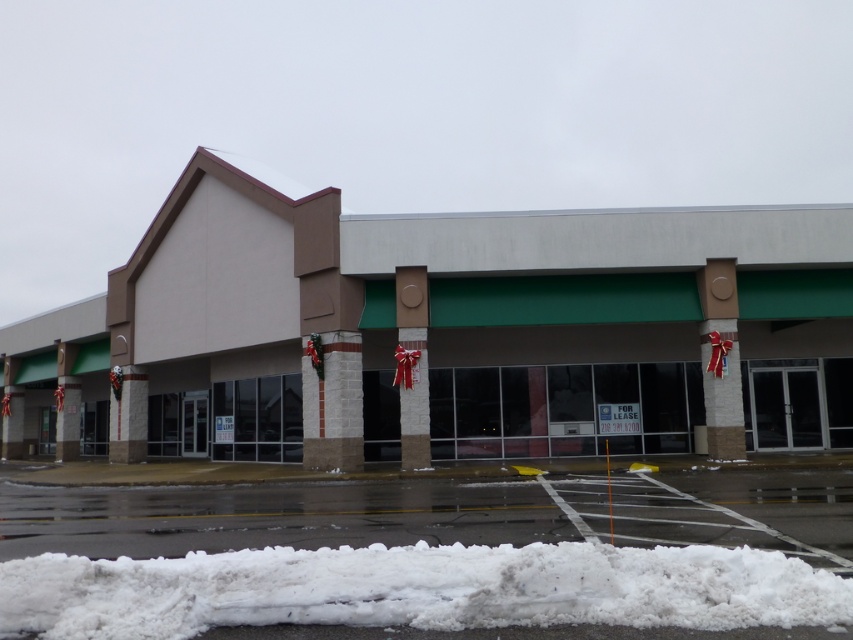
Question: Estimate the real-world distances between objects in this image. Which object is farther from the white fluffy snow at lower center?

Choices:
 (A) white concrete building at center
 (B) white asphalt parking lot at lower center
 (C) brown textured pillar at center

Answer: (A)

Question: Can you confirm if white fluffy snow at lower center is positioned below brown textured pillar at center?

Choices:
 (A) yes
 (B) no

Answer: (A)

Question: Does white concrete building at center have a smaller size compared to white fluffy snow at lower center?

Choices:
 (A) no
 (B) yes

Answer: (A)

Question: Among these objects, which one is farthest from the camera?

Choices:
 (A) white asphalt parking lot at lower center
 (B) brown textured pillar at center
 (C) white concrete building at center

Answer: (C)

Question: Which point is farther to the camera?

Choices:
 (A) white concrete building at center
 (B) white fluffy snow at lower center
 (C) white asphalt parking lot at lower center

Answer: (A)

Question: Does white concrete building at center have a greater width compared to white fluffy snow at lower center?

Choices:
 (A) no
 (B) yes

Answer: (B)